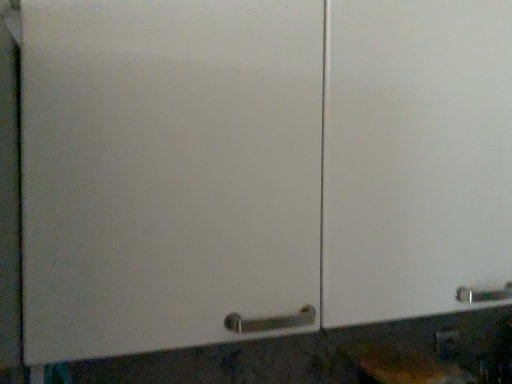
This screenshot has height=384, width=512. Find the location of `matte plastic outlet at lower right`. matte plastic outlet at lower right is located at coordinates (447, 343).

This screenshot has width=512, height=384. Describe the element at coordinates (447, 343) in the screenshot. I see `matte plastic outlet at lower right` at that location.

Locate an element on the screen. This screenshot has height=384, width=512. matte plastic outlet at lower right is located at coordinates (447, 343).